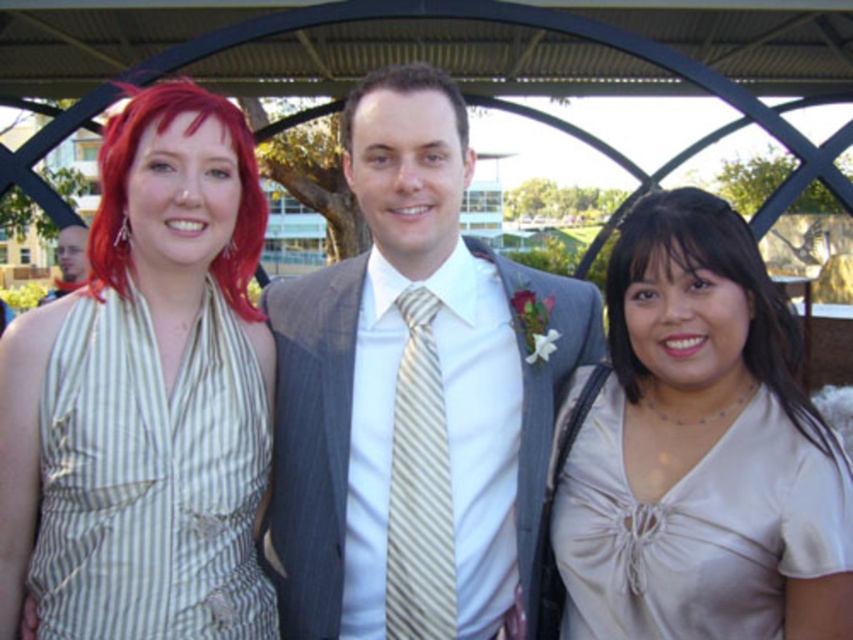
Locate an element on the screen. green striped fabric dress at left is located at coordinates (151, 481).

Image resolution: width=853 pixels, height=640 pixels. I want to click on green striped fabric dress at left, so click(x=151, y=481).

Does striped fabric suit at center have a smaller size compared to striped silk tie at center?

Incorrect, striped fabric suit at center is not smaller in size than striped silk tie at center.

I want to click on striped fabric suit at center, so click(x=413, y=392).

Which is in front, point (125, 152) or point (74, 227)?

Positioned in front is point (125, 152).

Which is behind, point (135, 102) or point (67, 234)?

The point (67, 234) is behind.

Is point (120, 140) behind point (68, 285)?

No, it is not.

Find the location of a particular element. vivid red hair at left is located at coordinates (126, 196).